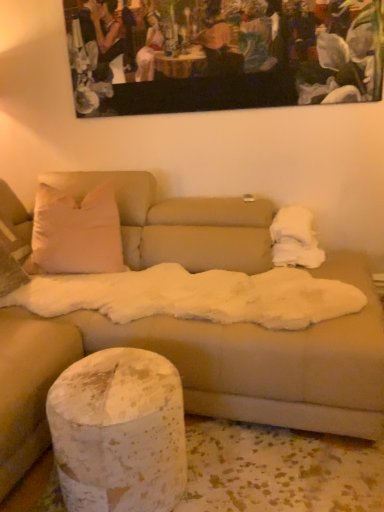
This screenshot has width=384, height=512. Identify the location of free space above speckled white cylinder at lower left (from a real-world perspective). (119, 369).